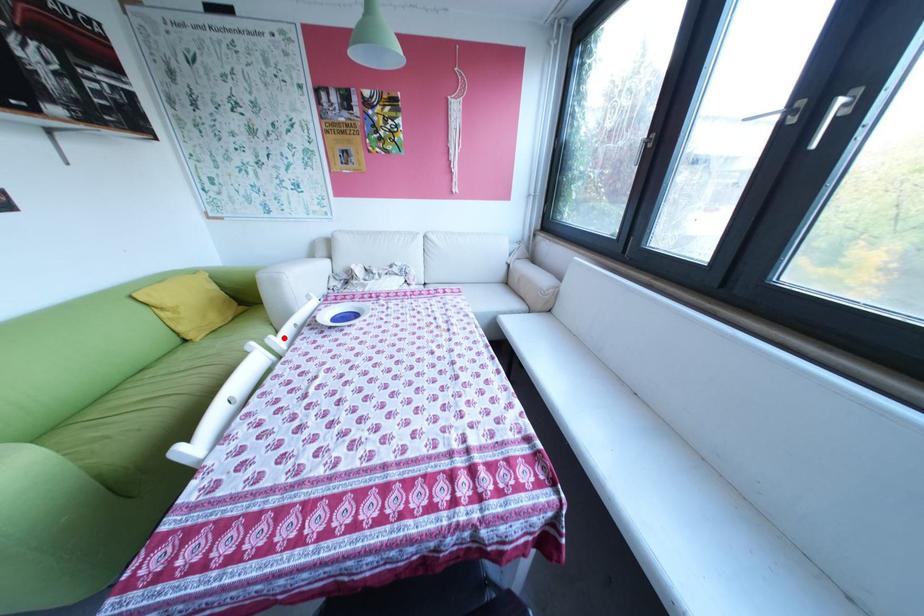
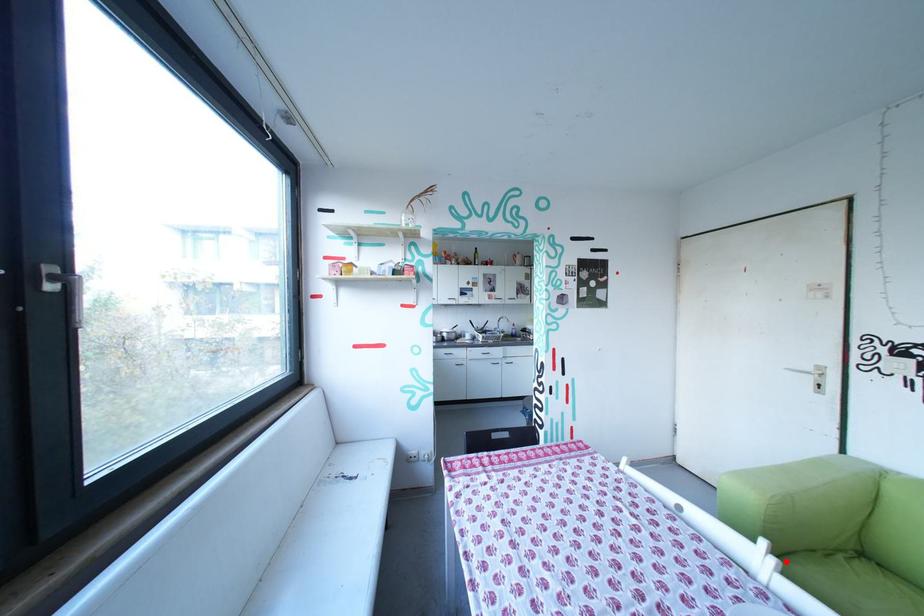
I am providing you with two images of the same scene from different viewpoints. A red point is marked on the first image and another point is marked on the second image. Do the highlighted points in image1 and image2 indicate the same real-world spot?

Yes